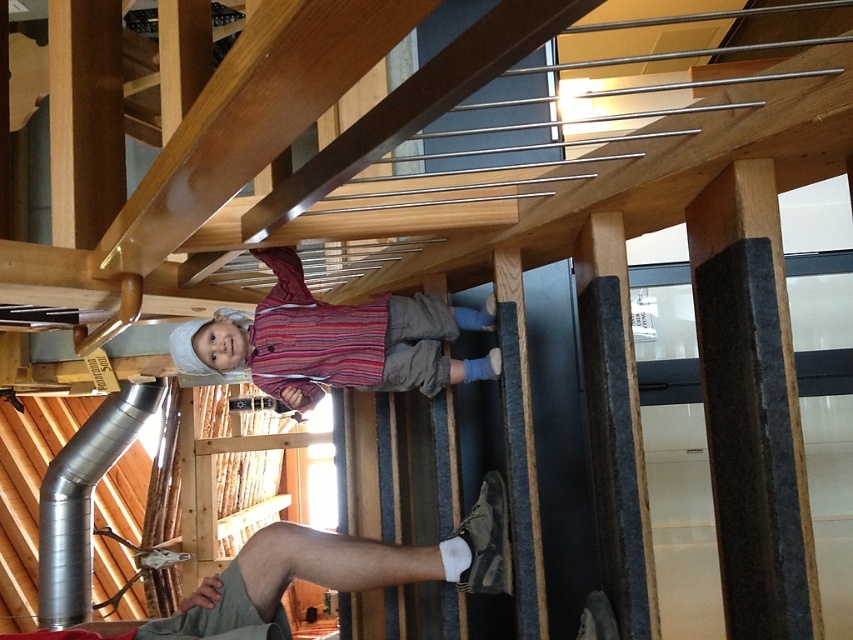
Question: Among these points, which one is farthest from the camera?

Choices:
 (A) (303, 300)
 (B) (450, 563)

Answer: (A)

Question: Is striped cotton shirt at center wider than silver metallic duct at lower left?

Choices:
 (A) yes
 (B) no

Answer: (A)

Question: Which of the following is the closest to the observer?

Choices:
 (A) (289, 372)
 (B) (473, 531)

Answer: (B)

Question: Can you confirm if light brown fabric leg at lower center is positioned below silver metallic duct at lower left?

Choices:
 (A) no
 (B) yes

Answer: (A)

Question: Among these points, which one is farthest from the camera?

Choices:
 (A) 231,589
 (B) 146,410
 (C) 276,342

Answer: (B)

Question: Is striped cotton shirt at center wider than light brown fabric leg at lower center?

Choices:
 (A) no
 (B) yes

Answer: (A)